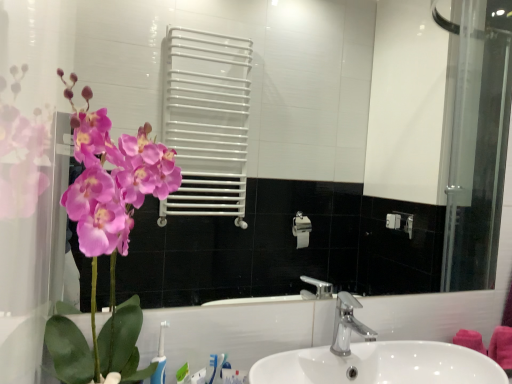
The image size is (512, 384). What are the coordinates of `silver metallic faucet at center` in the screenshot? It's located at (347, 324).

What is the approximate width of blue plastic toothbrush at lower left?

1.85 inches.

Measure the distance between point (408, 322) and camera.

Point (408, 322) is 3.71 feet from camera.

The width and height of the screenshot is (512, 384). In order to click on silver metallic faucet at center in this screenshot , I will do `click(347, 324)`.

From the image's perspective, between white glossy sink at center and silver metallic faucet at center, who is located below?

white glossy sink at center.

Is white glossy sink at center positioned with its back to silver metallic faucet at center?

No, white glossy sink at center is not facing away from silver metallic faucet at center.

Considering the relative sizes of white glossy sink at center and silver metallic faucet at center in the image provided, is white glossy sink at center shorter than silver metallic faucet at center?

No, white glossy sink at center is not shorter than silver metallic faucet at center.

In the scene shown: How much distance is there between blue plastic toothbrush at lower left and silver metallic faucet at center?

blue plastic toothbrush at lower left is 17.85 inches away from silver metallic faucet at center.

From a real-world perspective, is blue plastic toothbrush at lower left below silver metallic faucet at center?

Yes.

Considering the positions of objects blue plastic toothbrush at lower left and silver metallic faucet at center in the image provided, who is behind, blue plastic toothbrush at lower left or silver metallic faucet at center?

silver metallic faucet at center is behind.

Which is more to the left, blue plastic toothbrush at lower left or silver metallic faucet at center?

Positioned to the left is blue plastic toothbrush at lower left.

From the image's perspective, is silver metallic faucet at center beneath matte pink orchid at left?

Indeed, from the image's perspective, silver metallic faucet at center is shown beneath matte pink orchid at left.

In the scene shown: Does silver metallic faucet at center turn towards matte pink orchid at left?

No, silver metallic faucet at center is not aimed at matte pink orchid at left.

How different are the orientations of silver metallic faucet at center and matte pink orchid at left in degrees?

silver metallic faucet at center and matte pink orchid at left are facing 1.64 degrees away from each other.

Based on the photo, can you tell me how much white glossy sink at center and white glossy mirror at upper center differ in facing direction?

The angular difference between white glossy sink at center and white glossy mirror at upper center is 0.175 degrees.

Relative to white glossy mirror at upper center, is white glossy sink at center in front or behind?

Clearly, white glossy sink at center is in front of white glossy mirror at upper center.

Consider the image. From the image's perspective, between white glossy sink at center and white glossy mirror at upper center, who is located below?

white glossy sink at center, from the image's perspective.

Is point (364, 348) positioned behind point (352, 36)?

No, (364, 348) is closer to viewer.

This screenshot has width=512, height=384. I want to click on sink located in front of the blue plastic toothbrush at lower left, so click(x=395, y=347).

From the picture: Is blue plastic toothbrush at lower left directly adjacent to white glossy sink at center?

No, blue plastic toothbrush at lower left is not making contact with white glossy sink at center.

From the image's perspective, is blue plastic toothbrush at lower left above white glossy sink at center?

Correct, blue plastic toothbrush at lower left appears higher than white glossy sink at center in the image.

Is blue plastic toothbrush at lower left smaller than white glossy sink at center?

Yes, blue plastic toothbrush at lower left is smaller than white glossy sink at center.

Looking at this image, is the depth of silver metallic faucet at center less than that of white glossy mirror at upper center?

No, the depth of silver metallic faucet at center is greater than that of white glossy mirror at upper center.

From a real-world perspective, is silver metallic faucet at center on white glossy mirror at upper center?

No, from a real-world perspective, silver metallic faucet at center is not over white glossy mirror at upper center

Is silver metallic faucet at center next to white glossy mirror at upper center?

silver metallic faucet at center and white glossy mirror at upper center are clearly separated.

How different are the orientations of silver metallic faucet at center and white glossy mirror at upper center in degrees?

0.175 degrees separate the facing orientations of silver metallic faucet at center and white glossy mirror at upper center.

Identify the location of toothbrush below the silver metallic faucet at center (from the image's perspective). The width and height of the screenshot is (512, 384). (160, 358).

Considering the relative sizes of silver metallic faucet at center and blue plastic toothbrush at lower left in the image provided, is silver metallic faucet at center wider than blue plastic toothbrush at lower left?

Yes.

Considering the relative sizes of silver metallic faucet at center and blue plastic toothbrush at lower left in the image provided, is silver metallic faucet at center smaller than blue plastic toothbrush at lower left?

No, silver metallic faucet at center is not smaller than blue plastic toothbrush at lower left.

Which is in front, point (342, 344) or point (163, 352)?

The point (163, 352) is closer.

This screenshot has width=512, height=384. I want to click on tap above the white glossy sink at center (from the image's perspective), so click(x=347, y=324).

Locate an element on the screen. This screenshot has height=384, width=512. tap that is above the blue plastic toothbrush at lower left (from a real-world perspective) is located at coordinates (347, 324).

Based on their spatial positions, is silver metallic faucet at center or white glossy mirror at upper center closer to white glossy sink at center?

silver metallic faucet at center is closer to white glossy sink at center.

When comparing their distances from matte pink orchid at left, does white glossy sink at center or blue plastic toothbrush at lower left seem closer?

blue plastic toothbrush at lower left is closer to matte pink orchid at left.

Based on their spatial positions, is matte pink orchid at left or white glossy mirror at upper center further from silver metallic faucet at center?

white glossy mirror at upper center.

From the image, which object appears to be farther from white glossy mirror at upper center, white glossy sink at center or silver metallic faucet at center?

Based on the image, silver metallic faucet at center appears to be further to white glossy mirror at upper center.

Looking at the image, which one is located further to silver metallic faucet at center, white glossy mirror at upper center or blue plastic toothbrush at lower left?

Based on the image, white glossy mirror at upper center appears to be further to silver metallic faucet at center.

Looking at the image, which one is located closer to blue plastic toothbrush at lower left, matte pink orchid at left or white glossy mirror at upper center?

Based on the image, matte pink orchid at left appears to be nearer to blue plastic toothbrush at lower left.

When comparing their distances from blue plastic toothbrush at lower left, does white glossy sink at center or silver metallic faucet at center seem further?

The object further to blue plastic toothbrush at lower left is white glossy sink at center.

Considering their positions, is white glossy mirror at upper center positioned closer to white glossy sink at center than blue plastic toothbrush at lower left?

blue plastic toothbrush at lower left is positioned closer to the anchor white glossy sink at center.

This screenshot has width=512, height=384. Find the location of `floral arrangement that lies between white glossy mirror at upper center and white glossy sink at center from top to bottom`. floral arrangement that lies between white glossy mirror at upper center and white glossy sink at center from top to bottom is located at coordinates (109, 211).

Identify the location of tap between white glossy mirror at upper center and white glossy sink at center from top to bottom. The width and height of the screenshot is (512, 384). (347, 324).

Locate an element on the screen. tap situated between matte pink orchid at left and white glossy sink at center from left to right is located at coordinates (347, 324).

Where is `toothbrush between matte pink orchid at left and silver metallic faucet at center in the horizontal direction`? This screenshot has height=384, width=512. toothbrush between matte pink orchid at left and silver metallic faucet at center in the horizontal direction is located at coordinates (160, 358).